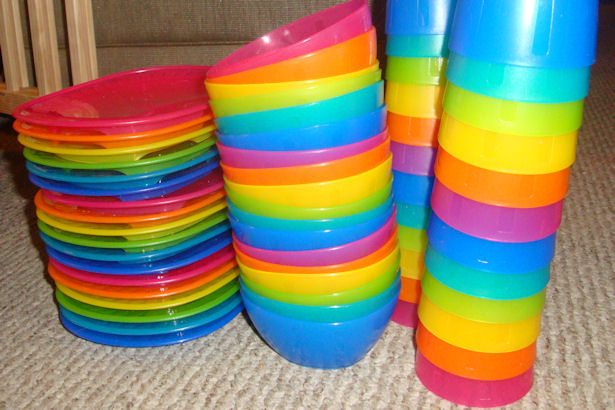
You are a GUI agent. You are given a task and a screenshot of the screen. Output one action in this format:
    pyautogui.click(x=<x>, y=<y>)
    Task: Click on the carepet
    The height and width of the screenshot is (410, 615).
    Given the screenshot: What is the action you would take?
    pyautogui.click(x=164, y=390)